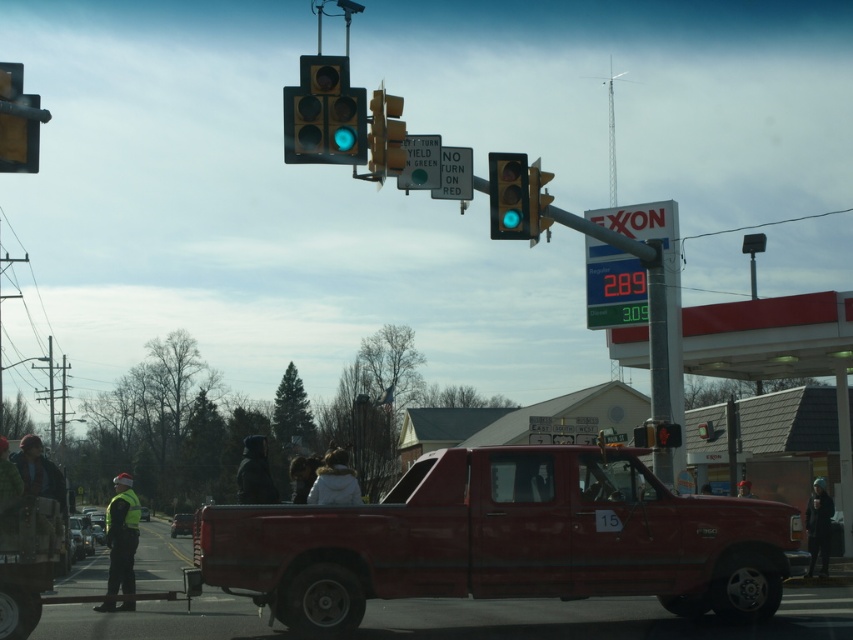
You are a pedestrian standing at the crosswalk near the metallic traffic light at upper left. You want to cross the street to reach the rustic metal pickup truck at center. Is the traffic light in your path?

The rustic metal pickup truck at center is closer to the viewer than the metallic traffic light at upper left, so the traffic light is behind you and not in your path.

You are a pedestrian standing at the intersection and need to cross the street. You see the matte glass traffic light at upper center and the green knit hat at lower left. Which object is closer to you as you stand there?

The matte glass traffic light at upper center is closer to you because it is further to the viewer than the green knit hat at lower left, meaning it appears nearer in your line of sight.